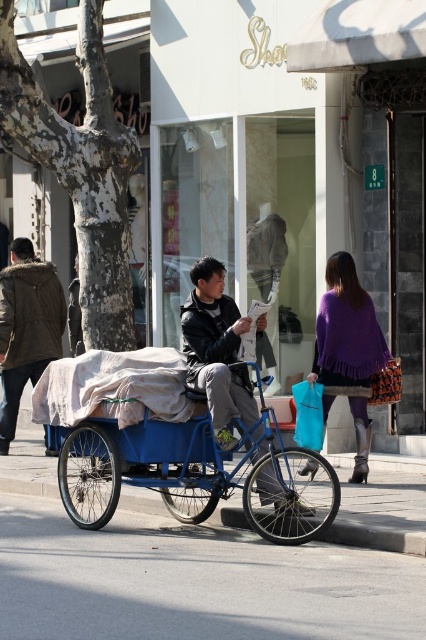
Can you confirm if blue matte tricycle at center is wider than brown fur-lined jacket at left?

Correct, the width of blue matte tricycle at center exceeds that of brown fur-lined jacket at left.

Is blue matte tricycle at center above brown fur-lined jacket at left?

No.

Who is more forward, (267,484) or (31,288)?

Positioned in front is point (267,484).

Identify the location of blue matte tricycle at center. The image size is (426, 640). (170, 449).

Does matte black jacket at center appear on the left side of brown fur-lined jacket at left?

Incorrect, matte black jacket at center is not on the left side of brown fur-lined jacket at left.

Is point (233, 376) less distant than point (55, 344)?

Yes, it is in front of point (55, 344).

You are a GUI agent. You are given a task and a screenshot of the screen. Output one action in this format:
    pyautogui.click(x=<x>, y=<y>)
    Task: Click on the matte black jacket at center
    
    Given the screenshot: What is the action you would take?
    pyautogui.click(x=216, y=349)

Consider the image. Which is below, gray asphalt at lower center or brown fur-lined jacket at left?

Positioned lower is gray asphalt at lower center.

Where is `gray asphalt at lower center`? The image size is (426, 640). gray asphalt at lower center is located at coordinates coord(192,582).